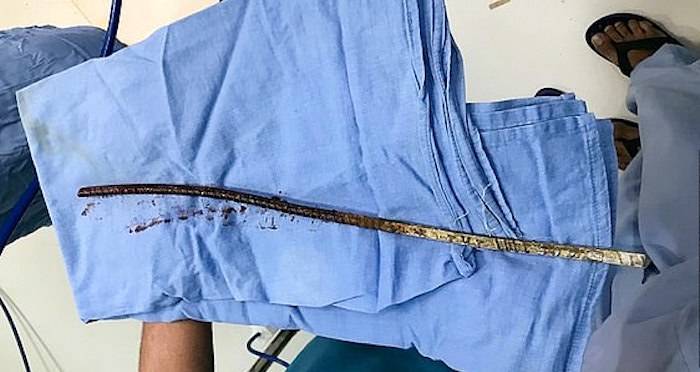
Locate an element on the screen. chair railing is located at coordinates (276, 344).